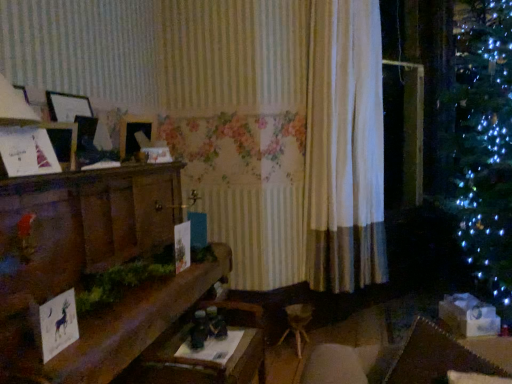
Question: In terms of height, does wooden table at center look taller or shorter compared to white paper card at lower left, the 1th christmas card positioned from the bottom?

Choices:
 (A) short
 (B) tall

Answer: (B)

Question: Based on their positions, is wooden table at center located to the left or right of white paper card at lower left, the 1th christmas card positioned from the bottom?

Choices:
 (A) right
 (B) left

Answer: (A)

Question: Estimate the real-world distances between objects in this image. Which object is closer to the white paper christmas card at left, which is the 1th christmas card in left-to-right order?

Choices:
 (A) white paper card at lower left, the 1th christmas card viewed from the right
 (B) white fabric curtain at center
 (C) wooden mantelpiece at left
 (D) wooden table at center

Answer: (C)

Question: Which is farther from the white paper card at lower left, which is the 2th christmas card in top-to-bottom order?

Choices:
 (A) wooden table at center
 (B) white paper christmas card at left, the second christmas card when ordered from right to left
 (C) wooden mantelpiece at left
 (D) white fabric curtain at center

Answer: (D)